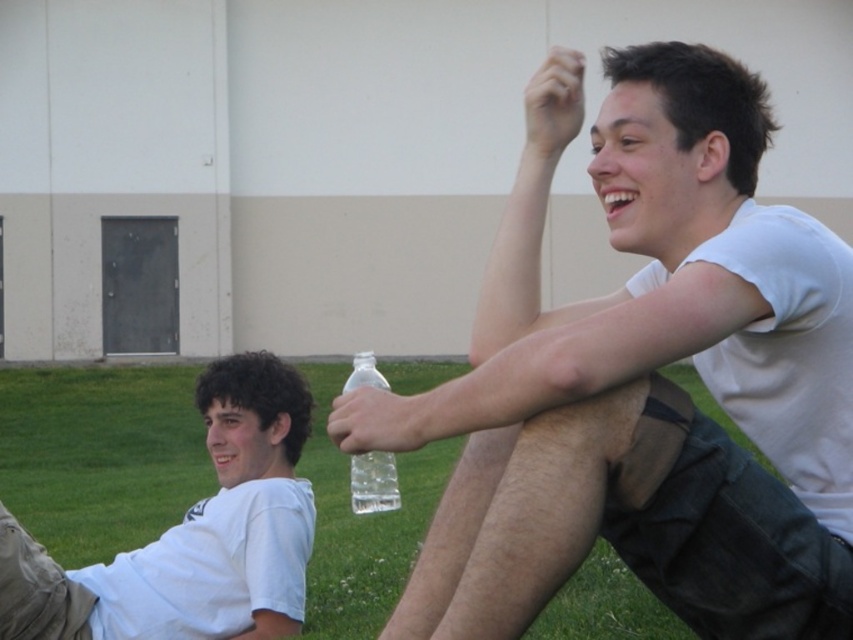
Does white matte shirt at upper right appear over transparent plastic bottle at center?

Indeed, white matte shirt at upper right is positioned over transparent plastic bottle at center.

Is white matte shirt at upper right shorter than transparent plastic bottle at center?

Indeed, white matte shirt at upper right has a lesser height compared to transparent plastic bottle at center.

The width and height of the screenshot is (853, 640). What do you see at coordinates (643, 378) in the screenshot? I see `white matte shirt at upper right` at bounding box center [643, 378].

I want to click on white matte shirt at upper right, so click(x=643, y=378).

Is white matte shirt at upper right to the left of green grass at lower center from the viewer's perspective?

No, white matte shirt at upper right is not to the left of green grass at lower center.

Which is in front, point (834, 298) or point (688, 376)?

Point (834, 298)

Between point (747, 164) and point (144, 406), which one is positioned behind?

The point (144, 406) is more distant.

The height and width of the screenshot is (640, 853). I want to click on white matte shirt at upper right, so click(x=643, y=378).

Which of these two, green grass at lower center or transparent plastic bottle at center, stands shorter?

green grass at lower center is shorter.

Where is `green grass at lower center`? green grass at lower center is located at coordinates (100, 456).

The width and height of the screenshot is (853, 640). I want to click on green grass at lower center, so click(100, 456).